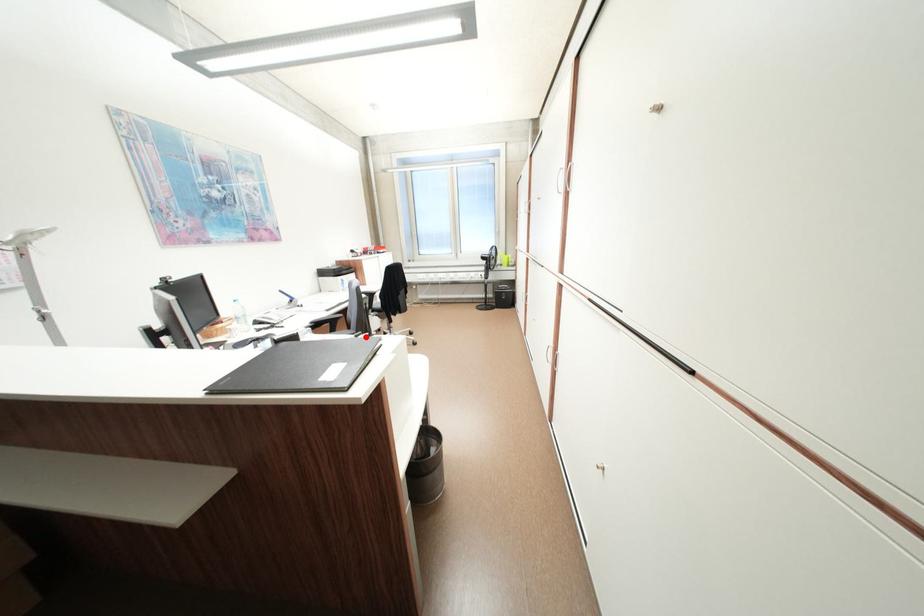
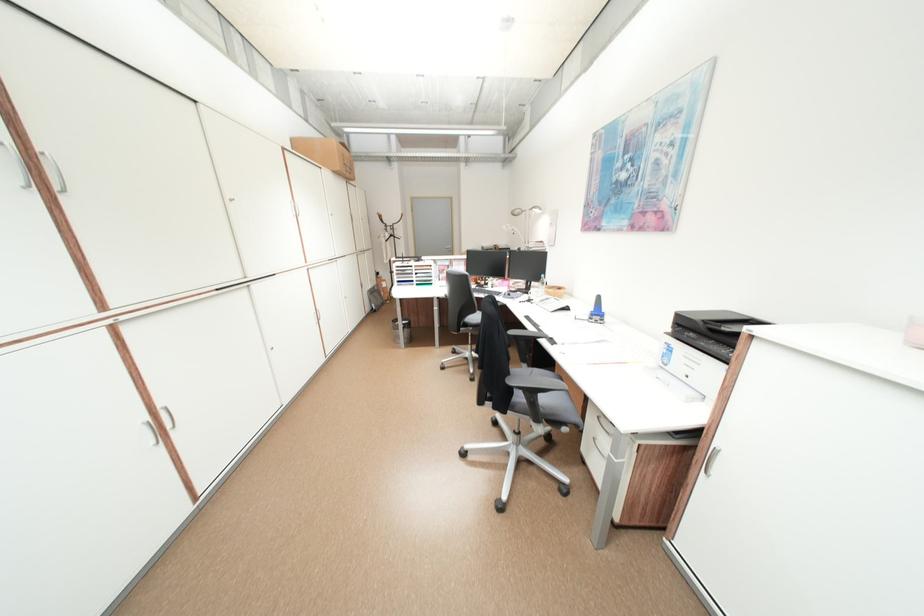
Question: I am providing you with two images of the same scene from different viewpoints. A red point is marked on the first image. Is the red point's position out of view in image 2?

Choices:
 (A) Yes
 (B) No

Answer: (A)